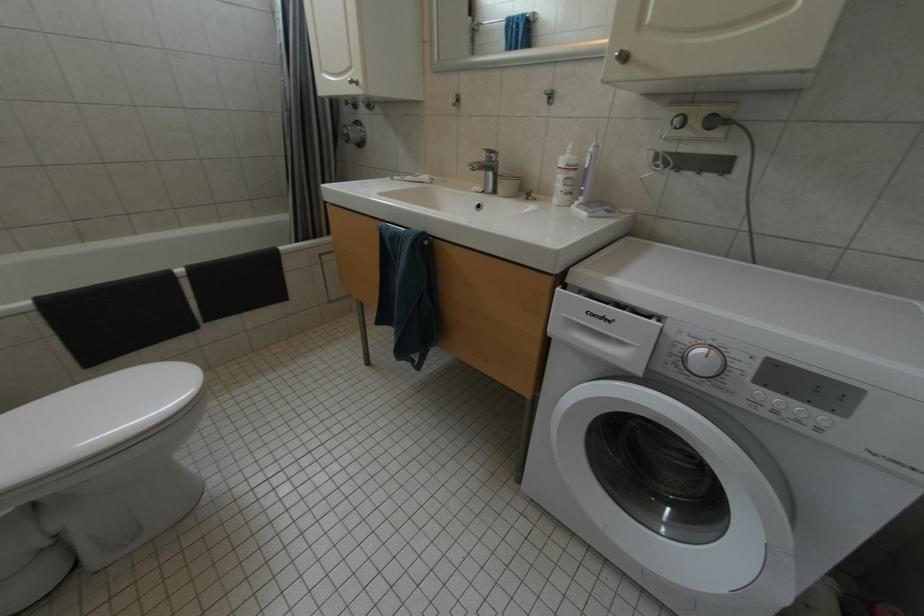
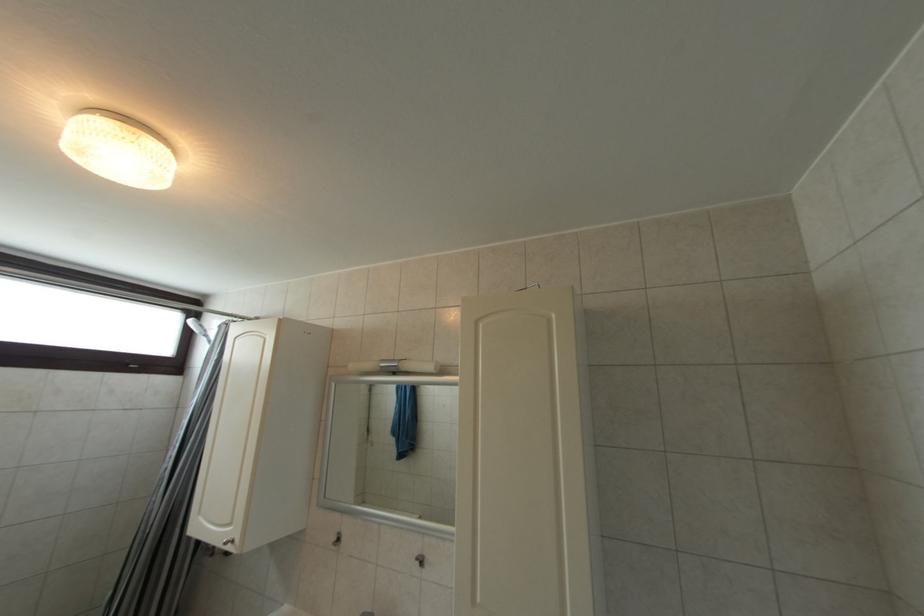
Looking at this image, first-person continuous shooting, in which direction is the camera rotating?

The camera's rotation is toward right-up.